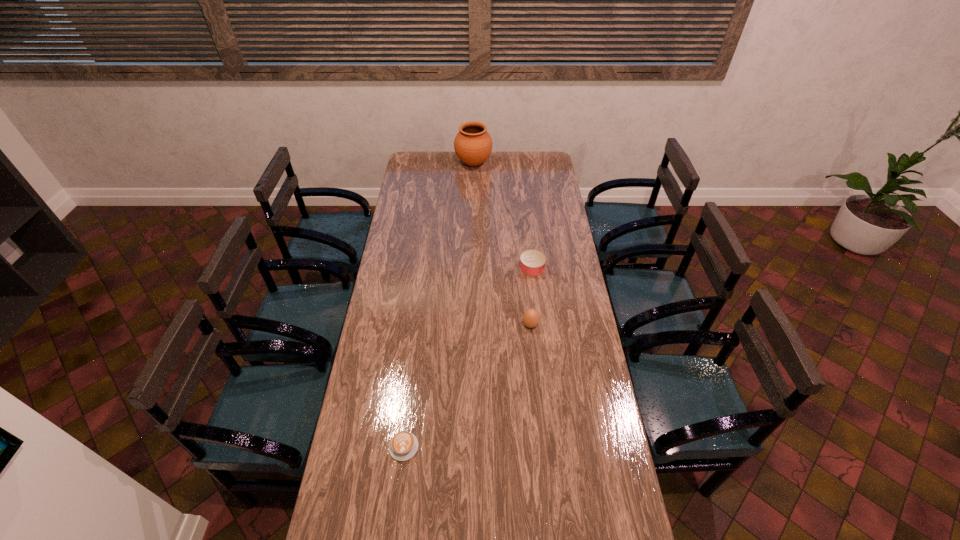
Identify the location of free spot that satisfies the following two spatial constraints: 1. on the side of the leftmost object with the handle; 2. on the right side of the third shortest object. This screenshot has width=960, height=540. (419, 325).

At what (x,y) coordinates should I click in order to perform the action: click on free location that satisfies the following two spatial constraints: 1. on the side of the second shortest object with the handle; 2. on the right side of the shortest object. Please return your answer as a coordinate pair (x, y). Looking at the image, I should click on (425, 268).

The image size is (960, 540). What are the coordinates of `vacant space that satisfies the following two spatial constraints: 1. on the side of the leftmost object with the handle; 2. on the left side of the third farthest object` in the screenshot? It's located at (419, 325).

I want to click on free spot that satisfies the following two spatial constraints: 1. on the side of the cappuccino with the handle; 2. on the left side of the farthest object, so click(x=439, y=163).